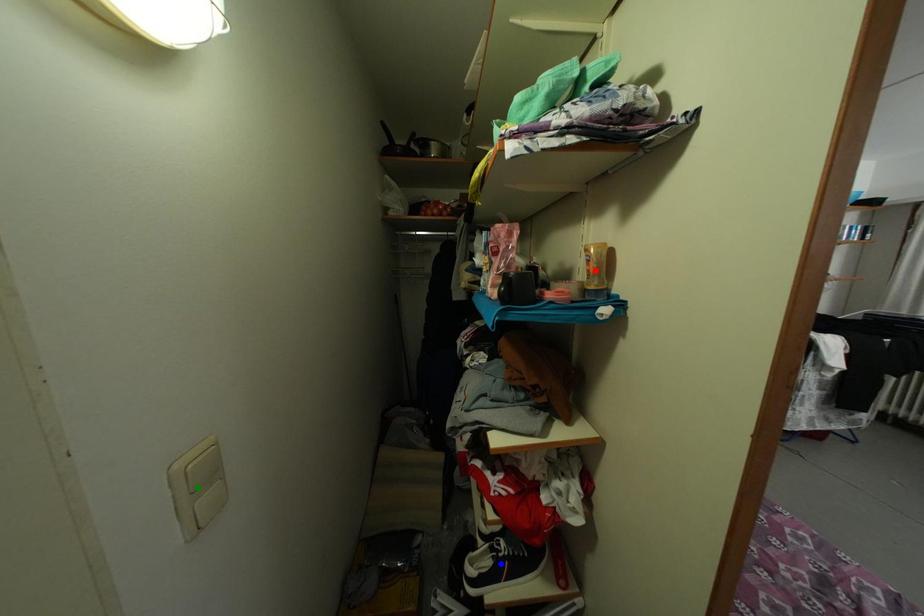
Order these from farthest to nearest:
- red point
- blue point
- green point

blue point → red point → green point